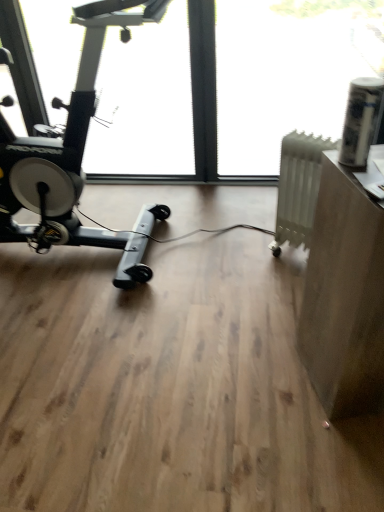
Identify the location of free space in front of transparent glass window at center, the 2th window screen when ordered from right to left. (157, 372).